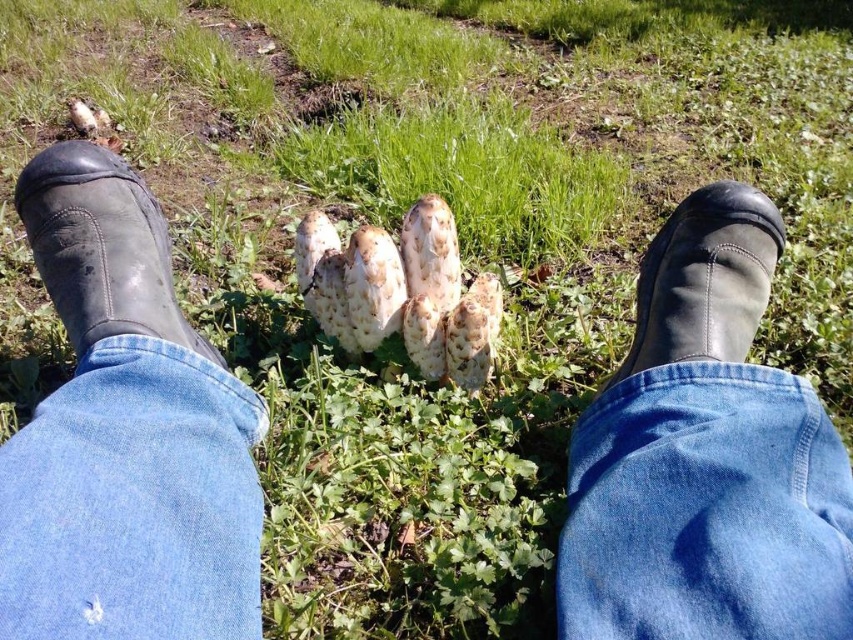
You are a gardener who needs to check the height of the denim at center and the black leather boot at left. Which object is taller?

The black leather boot at left is taller than the denim at center.